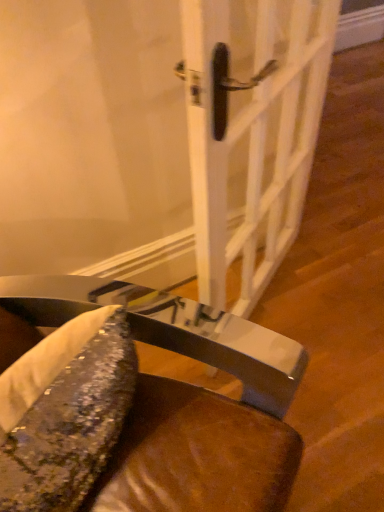
Question: Based on their sizes in the image, would you say white glossy door handle at center is bigger or smaller than metallic sequined cushion at lower center?

Choices:
 (A) big
 (B) small

Answer: (B)

Question: Considering the positions of white glossy door handle at center and metallic sequined cushion at lower center in the image, is white glossy door handle at center taller or shorter than metallic sequined cushion at lower center?

Choices:
 (A) short
 (B) tall

Answer: (B)

Question: Which is farther from the metallic sequined cushion at lower center?

Choices:
 (A) shiny metallic fish at lower left
 (B) white glossy door handle at center

Answer: (B)

Question: Based on their relative distances, which object is nearer to the white glossy door handle at center?

Choices:
 (A) shiny metallic fish at lower left
 (B) metallic sequined cushion at lower center

Answer: (B)